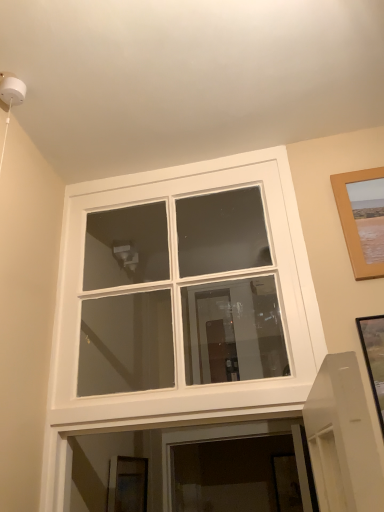
Question: Can you confirm if wooden picture frame at lower center, acting as the 2th picture frame starting from the front, is smaller than wooden picture frame at upper right, which appears as the 2th picture frame when viewed from the back?

Choices:
 (A) no
 (B) yes

Answer: (A)

Question: From the image's perspective, is wooden picture frame at lower center, acting as the 2th picture frame starting from the right, located beneath wooden picture frame at upper right, which appears as the 2th picture frame when viewed from the back?

Choices:
 (A) no
 (B) yes

Answer: (B)

Question: Does wooden picture frame at lower center, the 1th picture frame ordered from the bottom, lie behind wooden picture frame at upper right, the first picture frame from the right?

Choices:
 (A) yes
 (B) no

Answer: (A)

Question: Is wooden picture frame at lower center, which ranks as the 1th picture frame in back-to-front order, facing towards wooden picture frame at upper right, the first picture frame from the right?

Choices:
 (A) no
 (B) yes

Answer: (A)

Question: Can we say wooden picture frame at lower center, acting as the 2th picture frame starting from the right, lies outside wooden picture frame at upper right, arranged as the first picture frame when viewed from the top?

Choices:
 (A) no
 (B) yes

Answer: (B)

Question: From a real-world perspective, is wooden picture frame at upper right, which appears as the 2th picture frame when viewed from the back, above or below wooden picture frame at lower center, acting as the 2th picture frame starting from the right?

Choices:
 (A) above
 (B) below

Answer: (A)

Question: Considering the positions of wooden picture frame at upper right, which ranks as the first picture frame in front-to-back order, and wooden picture frame at lower center, placed as the 1th picture frame when sorted from left to right, in the image, is wooden picture frame at upper right, which ranks as the first picture frame in front-to-back order, bigger or smaller than wooden picture frame at lower center, placed as the 1th picture frame when sorted from left to right,?

Choices:
 (A) small
 (B) big

Answer: (A)

Question: Relative to wooden picture frame at lower center, the 1th picture frame ordered from the bottom, is wooden picture frame at upper right, which is counted as the second picture frame, starting from the left, in front or behind?

Choices:
 (A) front
 (B) behind

Answer: (A)

Question: From the image's perspective, is wooden picture frame at upper right, the first picture frame from the right, positioned above or below wooden picture frame at lower center, the 1th picture frame ordered from the bottom?

Choices:
 (A) above
 (B) below

Answer: (A)

Question: From the image's perspective, relative to wooden picture frame at upper right, the first picture frame from the right, is wooden picture frame at lower center, placed as the 1th picture frame when sorted from left to right, above or below?

Choices:
 (A) below
 (B) above

Answer: (A)

Question: In the image, is wooden picture frame at lower center, the 1th picture frame ordered from the bottom, on the left side or the right side of wooden picture frame at upper right, which appears as the 2th picture frame when viewed from the back?

Choices:
 (A) right
 (B) left

Answer: (B)

Question: Looking at their shapes, would you say wooden picture frame at lower center, acting as the 2th picture frame starting from the front, is wider or thinner than wooden picture frame at upper right, which ranks as the first picture frame in front-to-back order?

Choices:
 (A) wide
 (B) thin

Answer: (A)

Question: Does point (109, 464) appear closer or farther from the camera than point (352, 264)?

Choices:
 (A) farther
 (B) closer

Answer: (A)

Question: In terms of height, does white glass window at center look taller or shorter compared to wooden picture frame at upper right, which is counted as the second picture frame, starting from the left?

Choices:
 (A) short
 (B) tall

Answer: (B)

Question: Is white glass window at center situated inside wooden picture frame at upper right, the first picture frame from the right, or outside?

Choices:
 (A) outside
 (B) inside

Answer: (A)